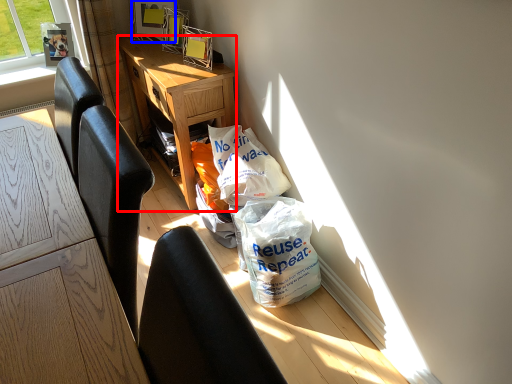
Question: Which object is closer to the camera taking this photo, desk (highlighted by a red box) or picture frame (highlighted by a blue box)?

Choices:
 (A) desk
 (B) picture frame

Answer: (A)